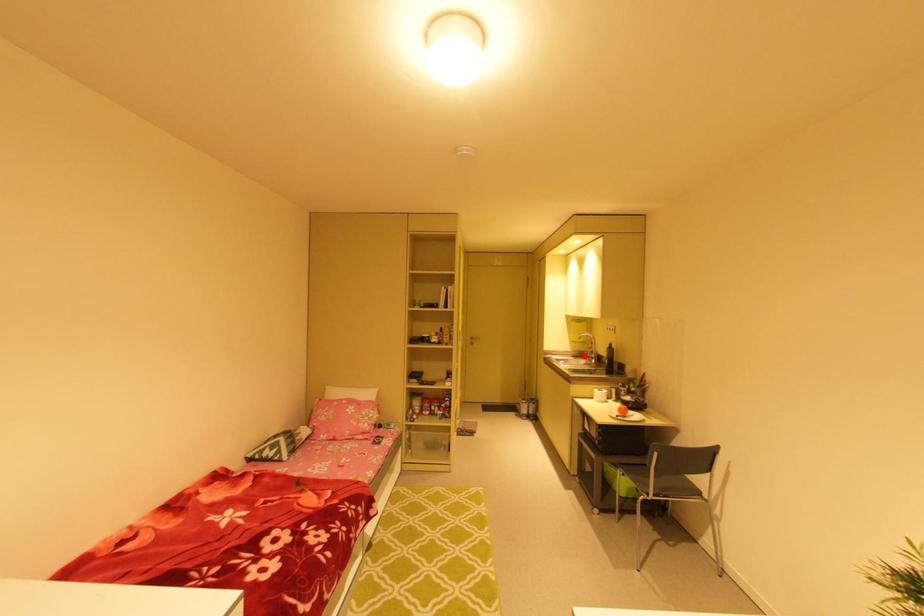
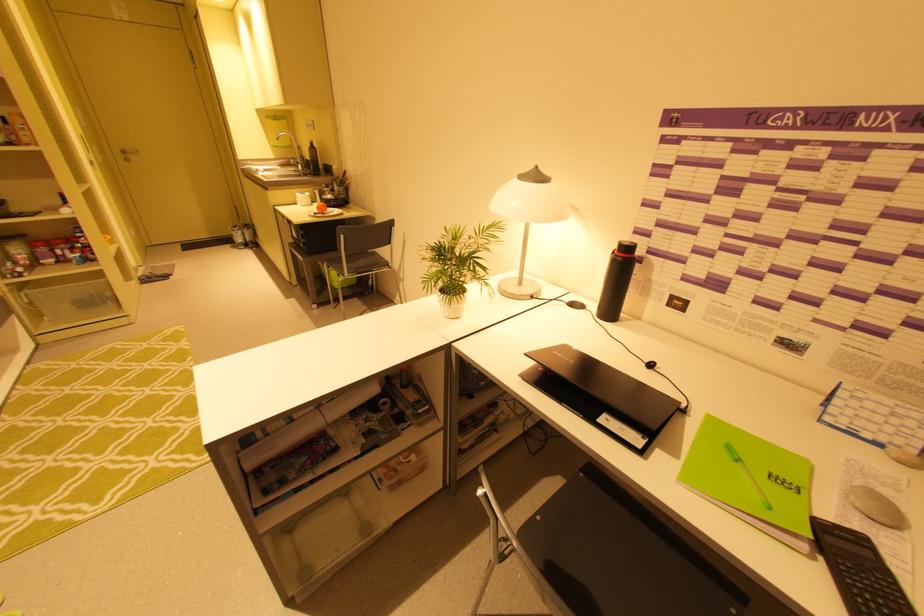
Question: A red point is marked in image1. In image2, is the corresponding 3D point closer to the camera or farther? Reply with the corresponding letter.

Choices:
 (A) The corresponding 3D point is closer.
 (B) The corresponding 3D point is farther.

Answer: (A)